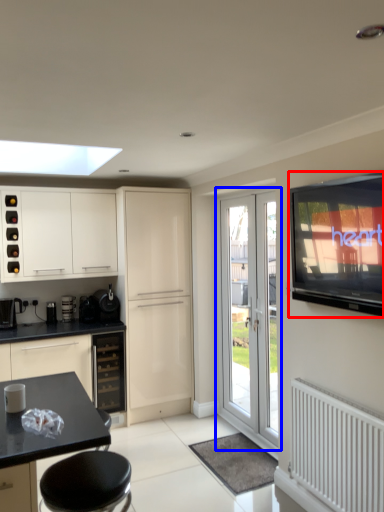
Question: Which object is further to the camera taking this photo, television (highlighted by a red box) or door (highlighted by a blue box)?

Choices:
 (A) television
 (B) door

Answer: (B)